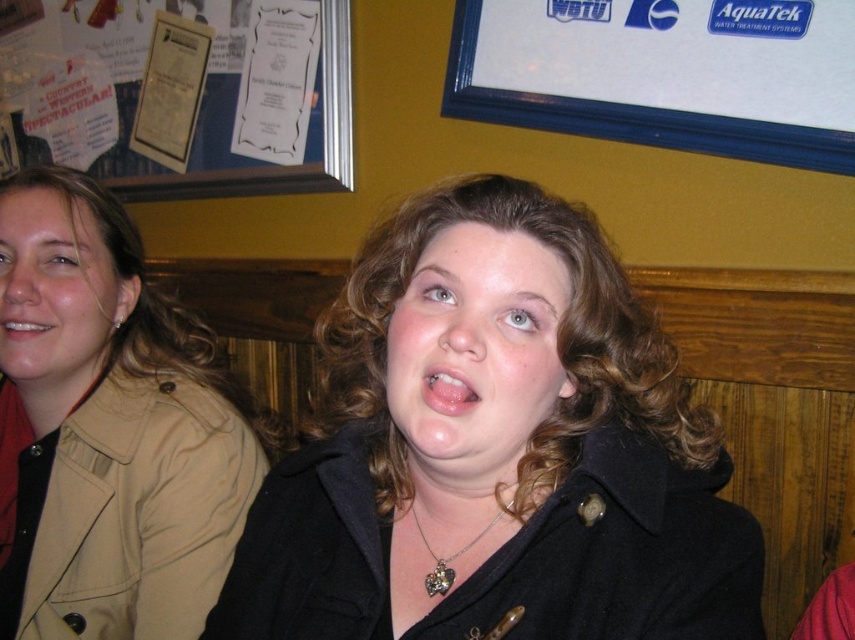
Does paperboard noticeboard at upper left appear over matte beige jacket at left?

Yes, paperboard noticeboard at upper left is above matte beige jacket at left.

Find the location of `paperboard noticeboard at upper left`. paperboard noticeboard at upper left is located at coordinates (180, 93).

Locate an element on the screen. The width and height of the screenshot is (855, 640). paperboard noticeboard at upper left is located at coordinates (180, 93).

Is point (513, 384) positioned after point (447, 564)?

No.

Does matte black coat at center have a lesser height compared to silver metallic heart-shaped pendant at center?

No.

Who is more distant from viewer, (441, 330) or (513, 502)?

Positioned behind is point (513, 502).

You are a GUI agent. You are given a task and a screenshot of the screen. Output one action in this format:
    pyautogui.click(x=<x>, y=<y>)
    Task: Click on the matte black coat at center
    This screenshot has height=640, width=855.
    Given the screenshot: What is the action you would take?
    pyautogui.click(x=476, y=349)

Is black matte coat at center bigger than tan fabric jacket at left?

Incorrect, black matte coat at center is not larger than tan fabric jacket at left.

Is black matte coat at center wider than tan fabric jacket at left?

Yes.

Find the location of a particular element. black matte coat at center is located at coordinates 496,451.